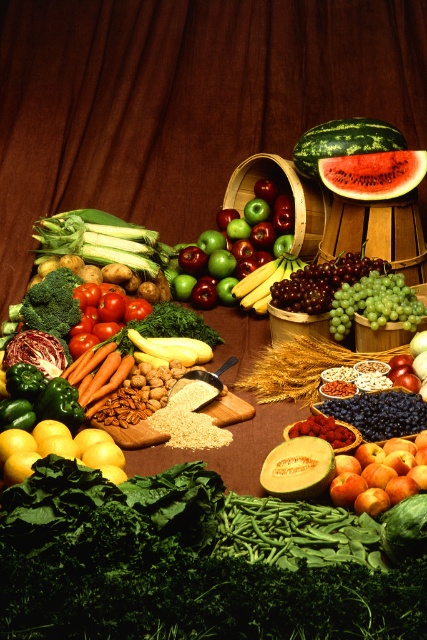
Who is positioned more to the right, brown wooden table at center or shiny red apple at center?

shiny red apple at center

Where is `brown wooden table at center`? Image resolution: width=427 pixels, height=640 pixels. brown wooden table at center is located at coordinates (183, 100).

How far apart are green matte apples at center and shiny red apple at center?

2.81 meters

Which is in front, point (215, 257) or point (414, 454)?

Point (414, 454)

Where is `green matte apples at center`? green matte apples at center is located at coordinates (236, 246).

Looking at this image, can you confirm if green shiny grapes at center is bigger than smooth red tomato at center?

No.

Can you confirm if green shiny grapes at center is positioned to the right of smooth red tomato at center?

Result: Indeed, green shiny grapes at center is positioned on the right side of smooth red tomato at center.

Based on the photo, who is more forward, (x=310, y=296) or (x=76, y=292)?

Positioned in front is point (x=310, y=296).

This screenshot has height=640, width=427. Identify the location of green shiny grapes at center. (321, 282).